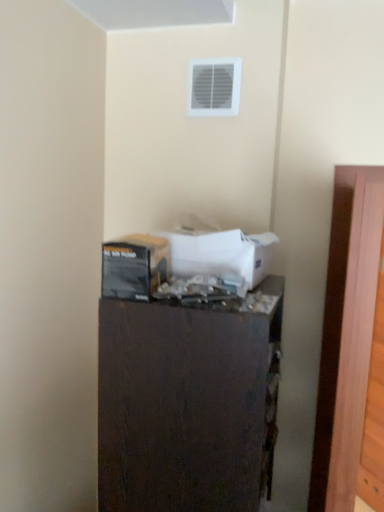
Question: Is dark wood dresser at center behind wooden at right?

Choices:
 (A) no
 (B) yes

Answer: (B)

Question: Can wooden at right be found inside dark wood dresser at center?

Choices:
 (A) no
 (B) yes

Answer: (A)

Question: From a real-world perspective, is dark wood dresser at center below wooden at right?

Choices:
 (A) no
 (B) yes

Answer: (B)

Question: Is the position of dark wood dresser at center less distant than that of wooden at right?

Choices:
 (A) yes
 (B) no

Answer: (B)

Question: Does dark wood dresser at center have a larger size compared to wooden at right?

Choices:
 (A) no
 (B) yes

Answer: (B)

Question: Is point (215, 105) positioned closer to the camera than point (157, 278)?

Choices:
 (A) closer
 (B) farther

Answer: (B)

Question: From a real-world perspective, relative to matte black box at center, which is the second box from right to left, is white plastic vent at upper center vertically above or below?

Choices:
 (A) above
 (B) below

Answer: (A)

Question: Is white plastic vent at upper center inside or outside of matte black box at center, the 1th box positioned from the left?

Choices:
 (A) outside
 (B) inside

Answer: (A)

Question: Relative to matte black box at center, which is the second box from right to left, is white plastic vent at upper center in front or behind?

Choices:
 (A) front
 (B) behind

Answer: (B)

Question: From a real-world perspective, is matte black box at center, the 1th box positioned from the left, positioned above or below dark wood dresser at center?

Choices:
 (A) above
 (B) below

Answer: (A)

Question: Considering the positions of matte black box at center, the 1th box positioned from the left, and dark wood dresser at center in the image, is matte black box at center, the 1th box positioned from the left, wider or thinner than dark wood dresser at center?

Choices:
 (A) wide
 (B) thin

Answer: (B)

Question: Choose the correct answer: Is matte black box at center, which is the second box from right to left, inside dark wood dresser at center or outside it?

Choices:
 (A) inside
 (B) outside

Answer: (B)

Question: Considering the positions of point (158, 272) and point (231, 481), is point (158, 272) closer or farther from the camera than point (231, 481)?

Choices:
 (A) farther
 (B) closer

Answer: (A)

Question: Is white cardboard box at center, the second box from the left, bigger or smaller than matte black box at center, which is the second box from right to left?

Choices:
 (A) small
 (B) big

Answer: (B)

Question: From a real-world perspective, is white cardboard box at center, the second box from the left, physically located above or below matte black box at center, the 1th box positioned from the left?

Choices:
 (A) below
 (B) above

Answer: (B)